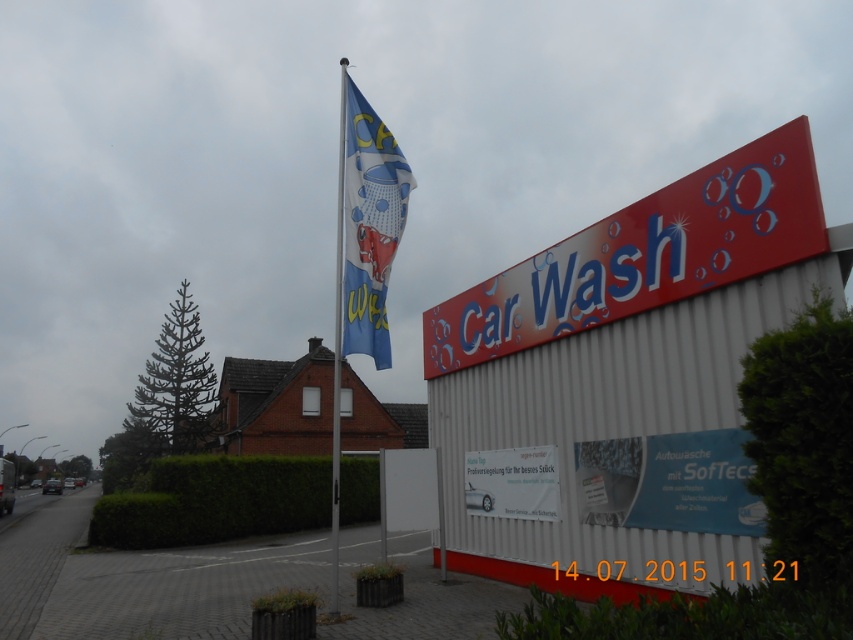
Which is behind, point (730, 548) or point (666, 268)?

Positioned behind is point (666, 268).

Which is more to the left, red corrugated metal car wash at upper right or red matte sign at upper right?

From the viewer's perspective, red corrugated metal car wash at upper right appears more on the left side.

Is point (453, 541) positioned in front of point (740, 230)?

No.

The width and height of the screenshot is (853, 640). I want to click on red corrugated metal car wash at upper right, so click(613, 424).

Image resolution: width=853 pixels, height=640 pixels. What do you see at coordinates (369, 224) in the screenshot?
I see `blue fabric flag at center` at bounding box center [369, 224].

Does point (364, 294) come in front of point (538, 456)?

Yes, it is in front of point (538, 456).

In order to click on blue fabric flag at center in this screenshot , I will do `click(369, 224)`.

Which of these two, red corrugated metal car wash at upper right or blue fabric flag at center, stands shorter?

Standing shorter between the two is red corrugated metal car wash at upper right.

Measure the distance from red corrugated metal car wash at upper right to blue fabric flag at center.

red corrugated metal car wash at upper right and blue fabric flag at center are 2.73 meters apart.

Does point (747, 344) come farther from viewer compared to point (363, 173)?

No.

You are a GUI agent. You are given a task and a screenshot of the screen. Output one action in this format:
    pyautogui.click(x=<x>, y=<y>)
    Task: Click on the red corrugated metal car wash at upper right
    Image resolution: width=853 pixels, height=640 pixels.
    Given the screenshot: What is the action you would take?
    (613, 424)